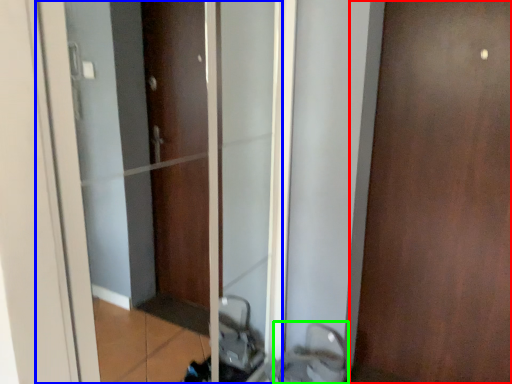
Question: Estimate the real-world distances between objects in this image. Which object is closer to door (highlighted by a red box), elevator (highlighted by a blue box) or sink (highlighted by a green box)?

Choices:
 (A) elevator
 (B) sink

Answer: (B)